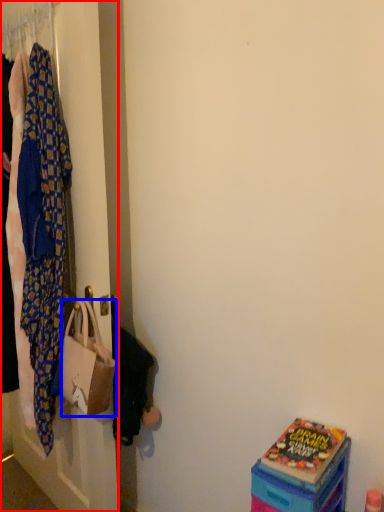
Question: Which point is further to the camera, closet (highlighted by a red box) or handbag (highlighted by a blue box)?

Choices:
 (A) closet
 (B) handbag

Answer: (B)